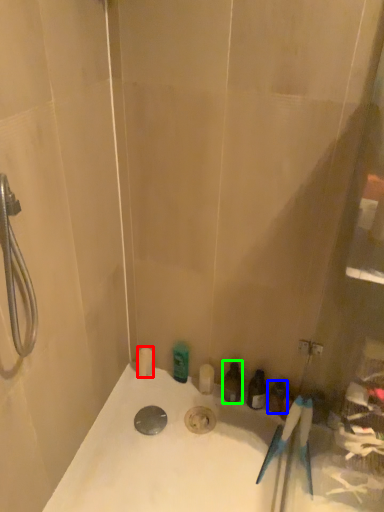
Question: Based on their relative distances, which object is farther from toiletry (highlighted by a red box)? Choose from toiletry (highlighted by a blue box) and toiletry (highlighted by a green box).

Choices:
 (A) toiletry
 (B) toiletry

Answer: (A)